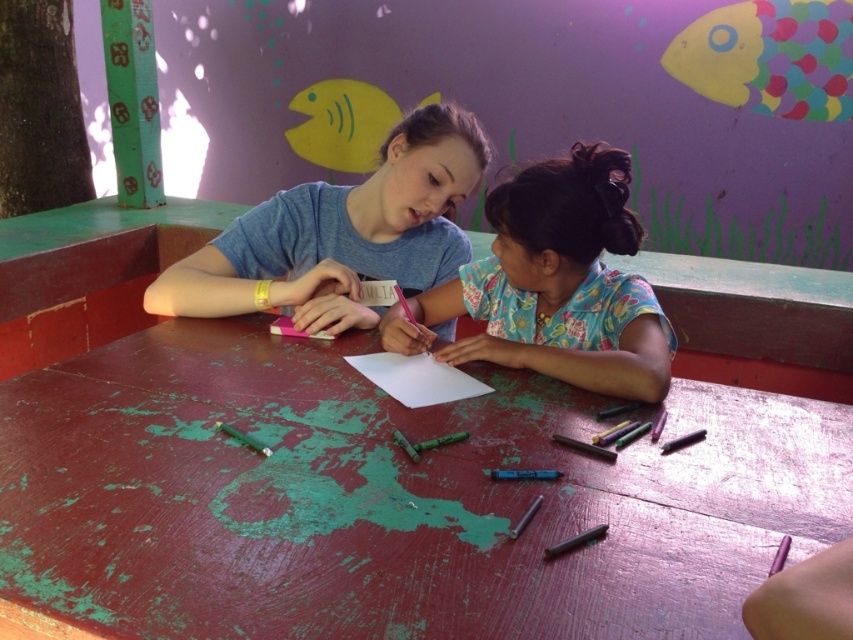
Question: Is metallic purple crayon at lower right below white paper at center?

Choices:
 (A) no
 (B) yes

Answer: (B)

Question: Which of these objects is positioned farthest from the metallic purple crayon at lower right?

Choices:
 (A) matte blue shirt at center
 (B) floral fabric shirt at center

Answer: (A)

Question: Which object appears closest to the camera in this image?

Choices:
 (A) metallic purple crayon at lower right
 (B) matte blue shirt at center
 (C) floral fabric shirt at center
 (D) rusty wood table at center

Answer: (A)

Question: Does matte blue shirt at center appear on the right side of metallic purple crayon at lower right?

Choices:
 (A) no
 (B) yes

Answer: (A)

Question: Can you confirm if rusty wood table at center is positioned to the left of metallic purple crayon at lower right?

Choices:
 (A) no
 (B) yes

Answer: (B)

Question: Which object appears farthest from the camera in this image?

Choices:
 (A) matte blue shirt at center
 (B) rusty wood table at center
 (C) floral fabric shirt at center

Answer: (A)